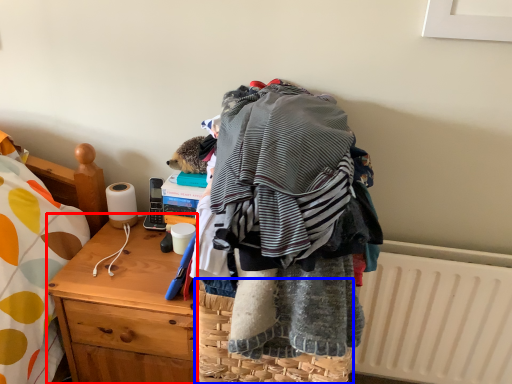
Question: Which of the following is the farthest to the observer, desk (highlighted by a red box) or picnic basket (highlighted by a blue box)?

Choices:
 (A) desk
 (B) picnic basket

Answer: (A)